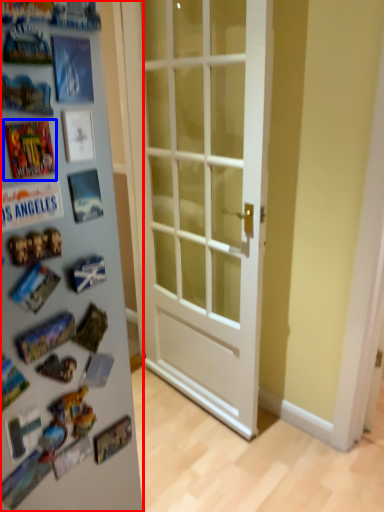
Question: Which object is further to the camera taking this photo, fridge (highlighted by a red box) or comic book (highlighted by a blue box)?

Choices:
 (A) fridge
 (B) comic book

Answer: (A)